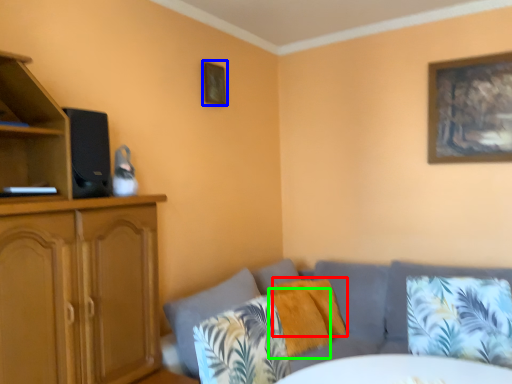
Question: Which is farther away from pillow (highlighted by a red box)? picture frame (highlighted by a blue box) or pillow (highlighted by a green box)?

Choices:
 (A) picture frame
 (B) pillow

Answer: (A)